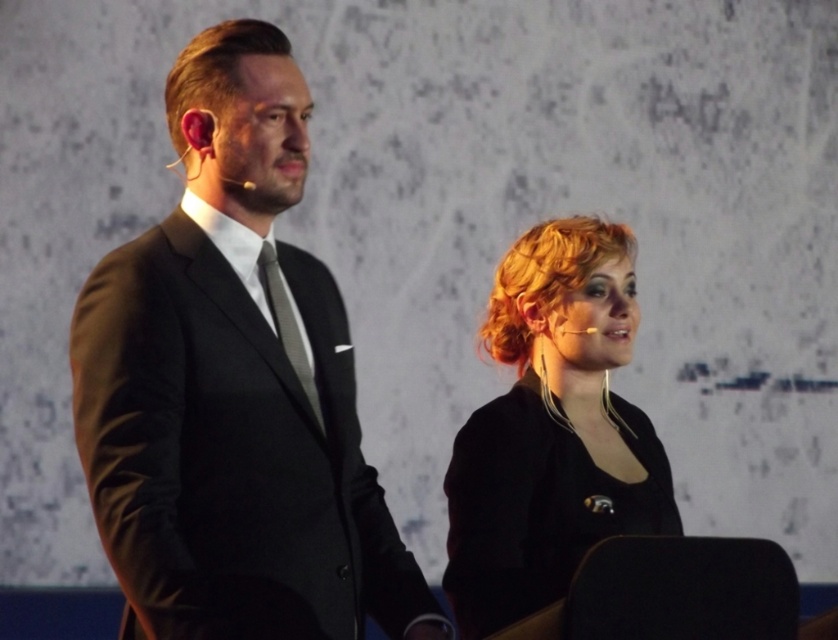
Does matte black suit at left appear on the left side of slicked-back brown hair at upper left?

No, matte black suit at left is not to the left of slicked-back brown hair at upper left.

Who is taller, matte black suit at left or slicked-back brown hair at upper left?

With more height is matte black suit at left.

Which is in front, point (347, 436) or point (197, 44)?

Point (197, 44) is in front.

The image size is (838, 640). Identify the location of matte black suit at left. click(x=233, y=387).

Can you confirm if matte black suit at left is shorter than blonde hair at lower right?

Incorrect, matte black suit at left's height does not fall short of blonde hair at lower right's.

Is point (303, 298) more distant than point (546, 464)?

No, (303, 298) is closer to viewer.

Locate an element on the screen. matte black suit at left is located at coordinates (233, 387).

Locate an element on the screen. matte black suit at left is located at coordinates (233, 387).

Does matte black suit at left appear under silky gray tie at center?

Yes.

Is matte black suit at left positioned before silky gray tie at center?

That is True.

Does point (190, 156) lie in front of point (272, 304)?

Yes.

Image resolution: width=838 pixels, height=640 pixels. What are the coordinates of `matte black suit at left` in the screenshot? It's located at (233, 387).